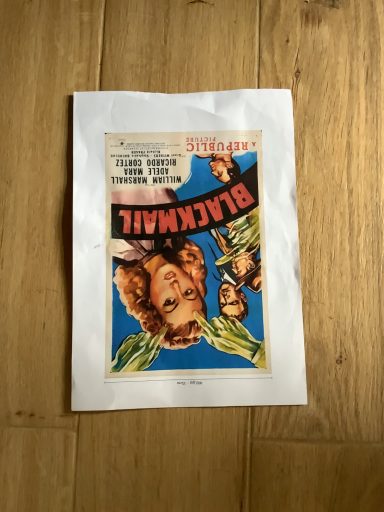
What do you see at coordinates (185, 251) in the screenshot? Image resolution: width=384 pixels, height=512 pixels. I see `vibrant paper poster at center` at bounding box center [185, 251].

The width and height of the screenshot is (384, 512). What are the coordinates of `vibrant paper poster at center` in the screenshot? It's located at (185, 251).

Find the location of a particular element. vibrant paper poster at center is located at coordinates (185, 251).